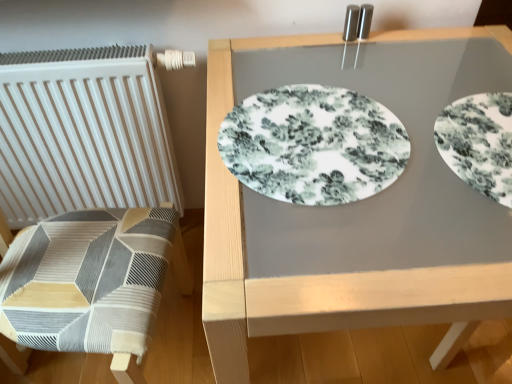
The height and width of the screenshot is (384, 512). Find the location of `free location to the left of white floral plate at upper right, placed as the first plate when sorted from right to left`. free location to the left of white floral plate at upper right, placed as the first plate when sorted from right to left is located at coordinates click(x=374, y=195).